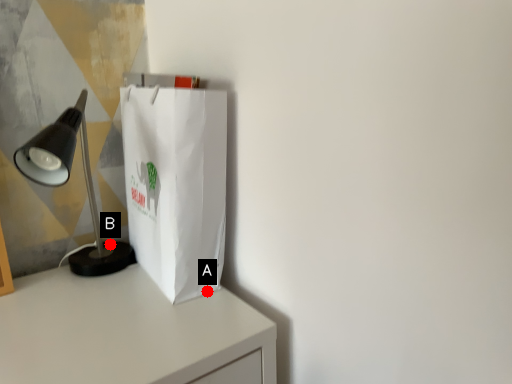
Question: Two points are circled on the image, labeled by A and B beside each circle. Among these points, which one is farthest from the camera?

Choices:
 (A) A is further
 (B) B is further

Answer: (B)